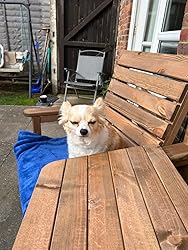
Where is `dark brown wooden door`? The image size is (188, 250). dark brown wooden door is located at coordinates (101, 21).